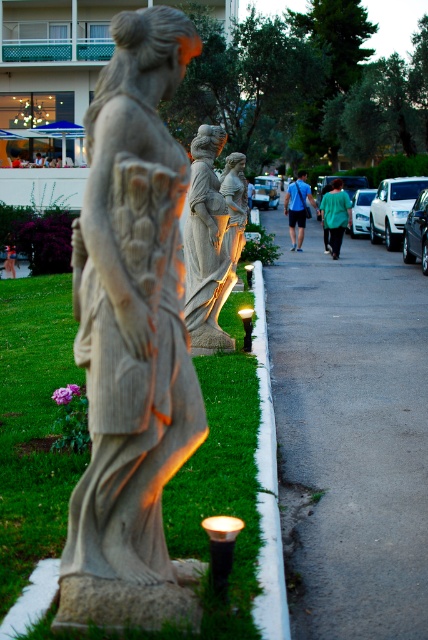
You are a person standing in the garden scene. You notice the gray asphalt pavement at center and the green fabric shirt at center. Which object is taller from your viewpoint?

The gray asphalt pavement at center is much taller than the green fabric shirt at center.

You are a delivery person trying to place a package on a surface in the scene. The package is 10 cm tall. Which object between the white concrete curb at lower center and the green fabric shirt at center can the package be placed on without it falling over?

The white concrete curb at lower center has a greater height compared to the green fabric shirt at center, so the package can be placed on the white concrete curb at lower center since it is taller and more stable.

You are standing at the edge of the grassy area and see the white concrete curb at lower center and the green fabric shirt at center. Which object is closer to your left side?

The white concrete curb at lower center is to the left of the green fabric shirt at center, so it is closer to your left side.